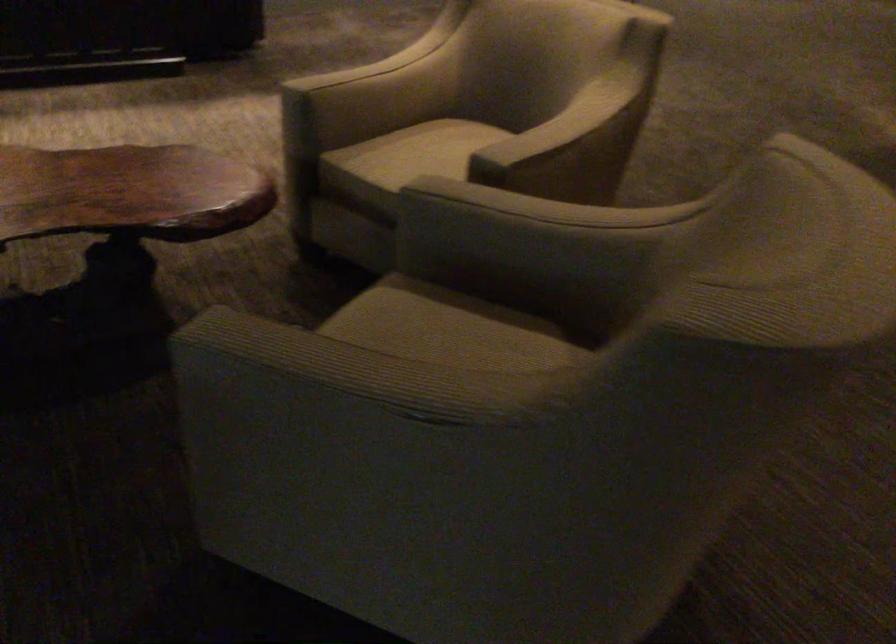
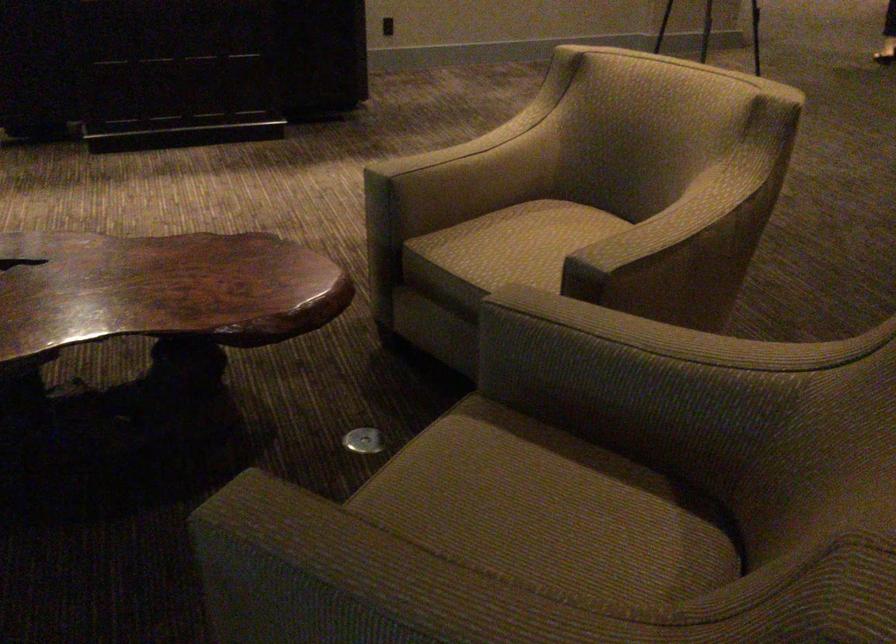
Where in the second image is the point corresponding to the point at 428,343 from the first image?

(512, 498)